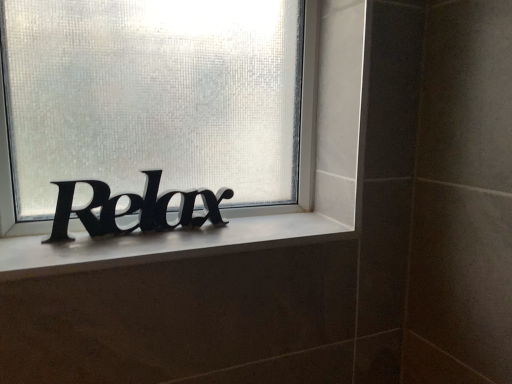
Question: Looking at their shapes, would you say white matte window sill at center is wider or thinner than black matte lettering at center?

Choices:
 (A) thin
 (B) wide

Answer: (B)

Question: From a real-world perspective, is white matte window sill at center above or below black matte lettering at center?

Choices:
 (A) below
 (B) above

Answer: (A)

Question: Which object is the farthest from the white matte window sill at center?

Choices:
 (A) black matte sign at center
 (B) black matte lettering at center

Answer: (A)

Question: Which of these objects is positioned farthest from the black matte sign at center?

Choices:
 (A) black matte lettering at center
 (B) white matte window sill at center

Answer: (B)